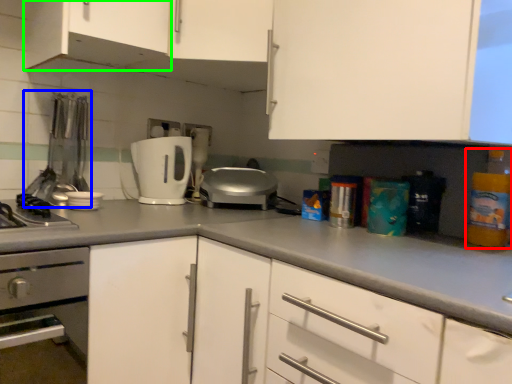
Question: Which object is the farthest from bottle (highlighted by a red box)? Choose among these: appliance (highlighted by a blue box) or cabinetry (highlighted by a green box).

Choices:
 (A) appliance
 (B) cabinetry

Answer: (A)